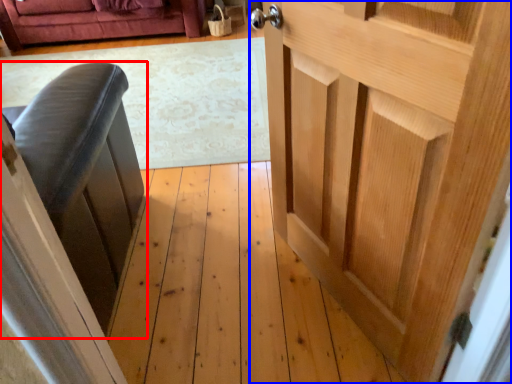
Question: Which object is further to the camera taking this photo, furniture (highlighted by a red box) or door (highlighted by a blue box)?

Choices:
 (A) furniture
 (B) door

Answer: (A)